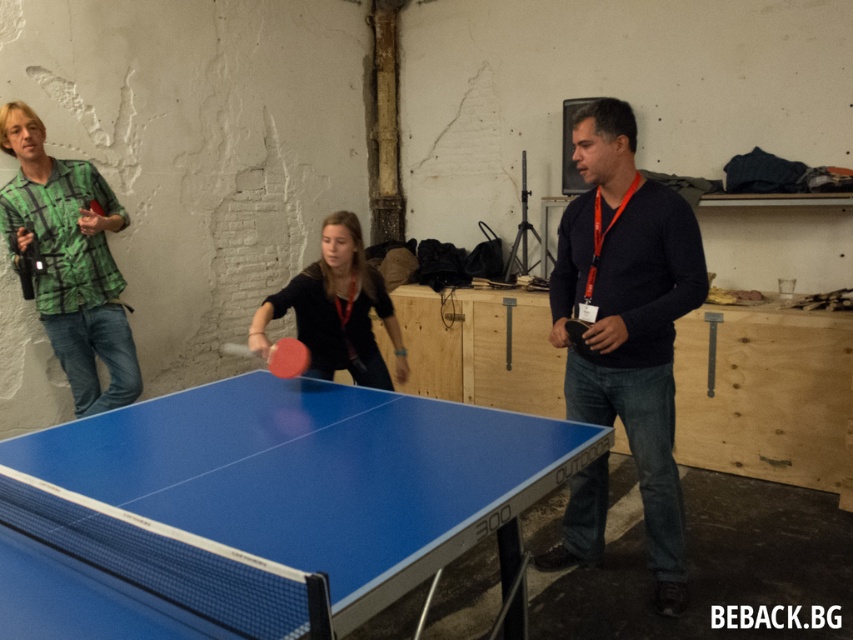
You are a photographer trying to capture a dynamic shot of the table tennis game. You need to position yourself so that both the blue glossy table tennis table at center and the matte black ping pong paddle at center are clearly visible in your frame. Based on their positions, which object should you place on the left side of your camera viewfinder to ensure both are in the shot?

The matte black ping pong paddle at center should be placed on the left side of your camera viewfinder because the blue glossy table tennis table at center is to the right of the matte black ping pong paddle at center, so positioning the paddle on the left will allow the table to naturally fall to the right within the frame.

You are standing at the origin of a coordinate system where the bottom left corner of the image is the origin point. The blue glossy table tennis table at center is marked by the point (318, 476). If you want to walk directly to the blue glossy table tennis table at center from your current position at the origin, which direction should you move in terms of x and y coordinates?

To reach the blue glossy table tennis table at center from the origin, you should move in the positive x and positive y directions since the point (318, 476) has both x and y values greater than zero.

You are a spectator standing at the back of the room and want to place a drink on the blue glossy table tennis table at center without it falling off. Considering the position of the rubber paddle at center, where should you place the drink?

The blue glossy table tennis table at center is below the rubber paddle at center, so placing the drink on the table away from the area directly under the paddle would prevent it from being knocked over.